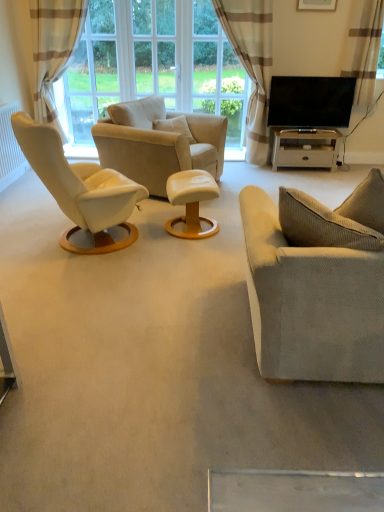
The width and height of the screenshot is (384, 512). What do you see at coordinates (53, 50) in the screenshot?
I see `beige striped curtain at left, the first curtain in the left-to-right sequence` at bounding box center [53, 50].

Locate an element on the screen. The image size is (384, 512). transparent glass window at center, marked as the 2th window screen in a right-to-left arrangement is located at coordinates (155, 48).

Where is `beige fabric armchair at center`? The height and width of the screenshot is (512, 384). beige fabric armchair at center is located at coordinates (159, 142).

Where is `beige striped curtain at upper center, the 2th curtain positioned from the right`? This screenshot has width=384, height=512. beige striped curtain at upper center, the 2th curtain positioned from the right is located at coordinates (252, 64).

Measure the distance between clear glass window at center, which ranks as the 1th window screen in right-to-left order, and camera.

Answer: clear glass window at center, which ranks as the 1th window screen in right-to-left order, and camera are 5.65 meters apart.

Where is `clear glass window at center, placed as the 3th window screen when sorted from left to right`? This screenshot has height=512, width=384. clear glass window at center, placed as the 3th window screen when sorted from left to right is located at coordinates (218, 77).

Identify the location of beige striped curtain at left, the first curtain in the left-to-right sequence. (53, 50).

Do you think transparent glass window at upper center, arranged as the third window screen when viewed from the right, is within beige striped curtain at left, which is counted as the 3th curtain, starting from the right, or outside of it?

transparent glass window at upper center, arranged as the third window screen when viewed from the right, lies outside beige striped curtain at left, which is counted as the 3th curtain, starting from the right.

From a real-world perspective, is transparent glass window at upper center, marked as the first window screen in a left-to-right arrangement, located higher than beige striped curtain at left, the first curtain in the left-to-right sequence?

Yes, from a real-world perspective, transparent glass window at upper center, marked as the first window screen in a left-to-right arrangement, is over beige striped curtain at left, the first curtain in the left-to-right sequence

Based on their sizes in the image, would you say transparent glass window at upper center, arranged as the third window screen when viewed from the right, is bigger or smaller than beige striped curtain at left, which is counted as the 3th curtain, starting from the right?

Considering their sizes, transparent glass window at upper center, arranged as the third window screen when viewed from the right, takes up less space than beige striped curtain at left, which is counted as the 3th curtain, starting from the right.

Considering the sizes of objects transparent glass window at upper center, marked as the first window screen in a left-to-right arrangement, and beige striped curtain at left, which is counted as the 3th curtain, starting from the right, in the image provided, who is wider, transparent glass window at upper center, marked as the first window screen in a left-to-right arrangement, or beige striped curtain at left, which is counted as the 3th curtain, starting from the right,?

beige striped curtain at left, which is counted as the 3th curtain, starting from the right, is wider.

Find the location of `curtain that is the 2nd object located above the white matte radiator at left (from the image's perspective)`. curtain that is the 2nd object located above the white matte radiator at left (from the image's perspective) is located at coordinates (53, 50).

Considering the sizes of white matte radiator at left and beige striped curtain at left, which is counted as the 3th curtain, starting from the right, in the image, is white matte radiator at left wider or thinner than beige striped curtain at left, which is counted as the 3th curtain, starting from the right,?

In the image, white matte radiator at left appears to be more narrow than beige striped curtain at left, which is counted as the 3th curtain, starting from the right.

In the scene shown: Is white matte radiator at left looking in the opposite direction of beige striped curtain at left, the first curtain in the left-to-right sequence?

No, white matte radiator at left is not facing the opposite direction of beige striped curtain at left, the first curtain in the left-to-right sequence.

Is beige striped curtain at left, which is counted as the 3th curtain, starting from the right, at the back of black glossy tv at upper right?

That's not correct — black glossy tv at upper right is not looking away from beige striped curtain at left, which is counted as the 3th curtain, starting from the right.

Which point is more forward, (334, 97) or (54, 106)?

Positioned in front is point (334, 97).

From a real-world perspective, which object stands above the other?

beige striped curtain at left, the first curtain in the left-to-right sequence, from a real-world perspective.

Which object is positioned more to the left, black glossy tv at upper right or beige striped curtain at left, the first curtain in the left-to-right sequence?

beige striped curtain at left, the first curtain in the left-to-right sequence, is more to the left.

Can you confirm if beige fabric armchair at center is taller than brown textured curtain at upper right, which is the first curtain in right-to-left order?

Incorrect, the height of beige fabric armchair at center is not larger of that of brown textured curtain at upper right, which is the first curtain in right-to-left order.

Could brown textured curtain at upper right, which is the first curtain in right-to-left order, be considered to be inside beige fabric armchair at center?

No, brown textured curtain at upper right, which is the first curtain in right-to-left order, is not inside beige fabric armchair at center.

From the image's perspective, is beige fabric armchair at center above or below brown textured curtain at upper right, which is the first curtain in right-to-left order?

beige fabric armchair at center is situated lower than brown textured curtain at upper right, which is the first curtain in right-to-left order, in the image.

From the picture: How different are the orientations of beige fabric armchair at center and brown textured curtain at upper right, which is the first curtain in right-to-left order, in degrees?

They differ by 63.4 degrees in their facing directions.

In terms of size, does transparent glass window at center, marked as the 2th window screen in a right-to-left arrangement, appear bigger or smaller than matte white picture frame at upper center?

Clearly, transparent glass window at center, marked as the 2th window screen in a right-to-left arrangement, is larger in size than matte white picture frame at upper center.

Identify the location of window screen that is the 2nd object to the left of the matte white picture frame at upper center, starting at the anchor. The width and height of the screenshot is (384, 512). (155, 48).

Between transparent glass window at center, marked as the 2th window screen in a right-to-left arrangement, and matte white picture frame at upper center, which one has less height?

matte white picture frame at upper center.

Is transparent glass window at center, marked as the 2th window screen in a right-to-left arrangement, turned away from matte white picture frame at upper center?

No, transparent glass window at center, marked as the 2th window screen in a right-to-left arrangement, is not facing the opposite direction of matte white picture frame at upper center.

Based on the photo, considering the sizes of objects beige striped curtain at upper center, acting as the 2th curtain starting from the left, and black glossy tv at upper right in the image provided, who is smaller, beige striped curtain at upper center, acting as the 2th curtain starting from the left, or black glossy tv at upper right?

Smaller between the two is black glossy tv at upper right.

Is black glossy tv at upper right inside beige striped curtain at upper center, the 2th curtain positioned from the right?

No, black glossy tv at upper right is not inside beige striped curtain at upper center, the 2th curtain positioned from the right.

Is the surface of beige striped curtain at upper center, acting as the 2th curtain starting from the left, in direct contact with black glossy tv at upper right?

No, beige striped curtain at upper center, acting as the 2th curtain starting from the left, is not in contact with black glossy tv at upper right.

Locate an element on the screen. Image resolution: width=384 pixels, height=512 pixels. window screen directly beneath the clear glass window at center, placed as the 3th window screen when sorted from left to right (from a real-world perspective) is located at coordinates (90, 75).

Is clear glass window at center, which ranks as the 1th window screen in right-to-left order, bigger than transparent glass window at upper center, marked as the first window screen in a left-to-right arrangement?

No.

Is clear glass window at center, which ranks as the 1th window screen in right-to-left order, at the right side of transparent glass window at upper center, marked as the first window screen in a left-to-right arrangement?

Indeed, clear glass window at center, which ranks as the 1th window screen in right-to-left order, is positioned on the right side of transparent glass window at upper center, marked as the first window screen in a left-to-right arrangement.

There is a transparent glass window at upper center, arranged as the third window screen when viewed from the right. At what (x,y) coordinates should I click in order to perform the action: click on the 2nd curtain below it (from a real-world perspective). Please return your answer as a coordinate pair (x, y). Looking at the image, I should click on 53,50.

Where is `radiator below the beige striped curtain at left, the first curtain in the left-to-right sequence (from the image's perspective)`? The image size is (384, 512). radiator below the beige striped curtain at left, the first curtain in the left-to-right sequence (from the image's perspective) is located at coordinates (10, 149).

Which object lies further to the anchor point black glossy tv at upper right, beige striped curtain at left, the first curtain in the left-to-right sequence, or matte white picture frame at upper center?

The object further to black glossy tv at upper right is beige striped curtain at left, the first curtain in the left-to-right sequence.

When comparing their distances from black glossy tv at upper right, does beige striped curtain at left, which is counted as the 3th curtain, starting from the right, or clear glass window at center, which ranks as the 1th window screen in right-to-left order, seem closer?

The object closer to black glossy tv at upper right is clear glass window at center, which ranks as the 1th window screen in right-to-left order.

Which object lies further to the anchor point black glossy tv at upper right, transparent glass window at upper center, marked as the first window screen in a left-to-right arrangement, or transparent glass window at center, marked as the 2th window screen in a right-to-left arrangement?

Based on the image, transparent glass window at upper center, marked as the first window screen in a left-to-right arrangement, appears to be further to black glossy tv at upper right.

Estimate the real-world distances between objects in this image. Which object is closer to beige striped curtain at left, the first curtain in the left-to-right sequence, white matte radiator at left or beige corduroy couch at right?

white matte radiator at left is closer to beige striped curtain at left, the first curtain in the left-to-right sequence.

Estimate the real-world distances between objects in this image. Which object is further from beige striped curtain at upper center, the 2th curtain positioned from the right, matte white picture frame at upper center or brown textured curtain at upper right, marked as the third curtain in a left-to-right arrangement?

brown textured curtain at upper right, marked as the third curtain in a left-to-right arrangement, lies further to beige striped curtain at upper center, the 2th curtain positioned from the right, than the other object.

From the image, which object appears to be farther from beige fabric armchair at center, black glossy tv at upper right or matte white picture frame at upper center?

Among the two, matte white picture frame at upper center is located further to beige fabric armchair at center.

When comparing their distances from beige striped curtain at upper center, the 2th curtain positioned from the right, does clear glass window at center, which ranks as the 1th window screen in right-to-left order, or beige leather ottoman at center, which is the 2th table in right-to-left order, seem further?

Among the two, beige leather ottoman at center, which is the 2th table in right-to-left order, is located further to beige striped curtain at upper center, the 2th curtain positioned from the right.

Considering their positions, is white matte radiator at left positioned closer to beige striped curtain at left, which is counted as the 3th curtain, starting from the right, than transparent glass window at center, the 2th window screen viewed from the left?

Based on the image, transparent glass window at center, the 2th window screen viewed from the left, appears to be nearer to beige striped curtain at left, which is counted as the 3th curtain, starting from the right.

The width and height of the screenshot is (384, 512). In order to click on window screen located between beige striped curtain at left, which is counted as the 3th curtain, starting from the right, and transparent glass window at center, the 2th window screen viewed from the left, in the left-right direction in this screenshot , I will do `click(90, 75)`.

This screenshot has height=512, width=384. In order to click on television between beige fabric armchair at center and matte white picture frame at upper center in this screenshot , I will do `click(310, 102)`.

The image size is (384, 512). Identify the location of chair between beige striped curtain at left, which is counted as the 3th curtain, starting from the right, and black glossy tv at upper right from left to right. (159, 142).

Locate an element on the screen. chair between beige corduroy couch at right and beige striped curtain at left, which is counted as the 3th curtain, starting from the right, from front to back is located at coordinates click(x=159, y=142).